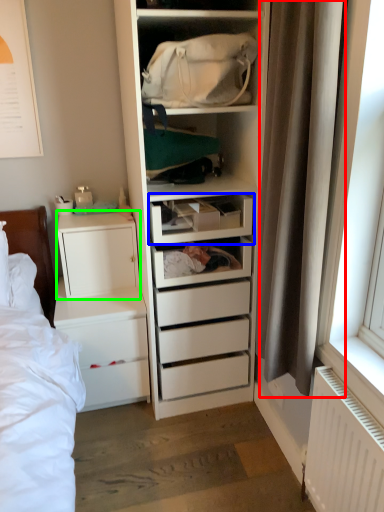
Question: Which object is positioned closest to curtain (highlighted by a red box)? Select from drawer (highlighted by a blue box) and cabinetry (highlighted by a green box).

Choices:
 (A) drawer
 (B) cabinetry

Answer: (A)